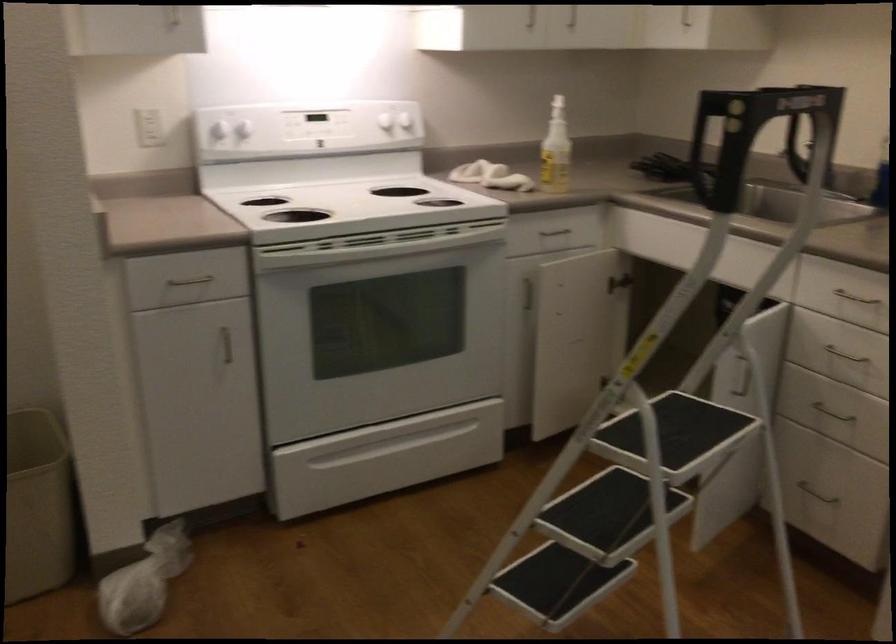
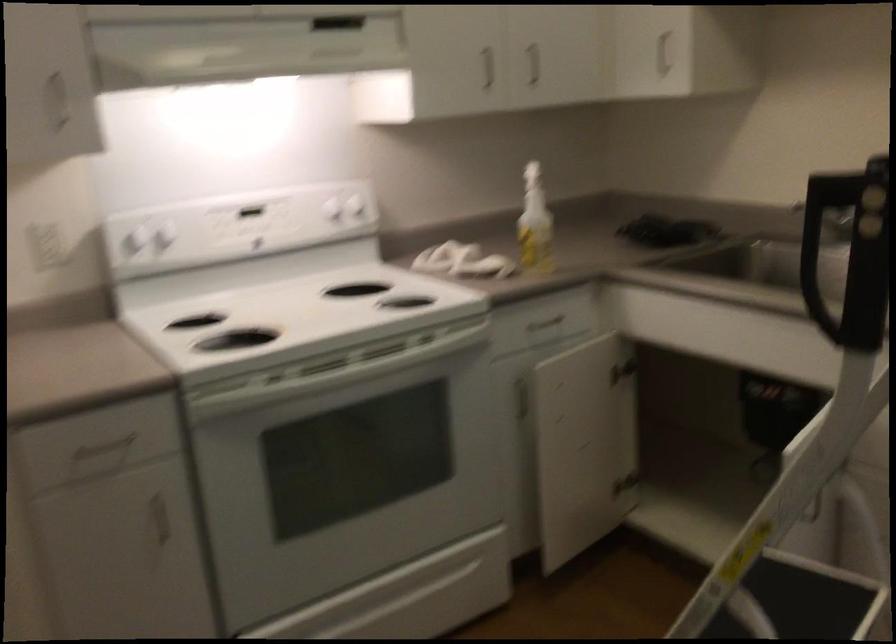
Locate, in the second image, the point that corresponds to pixel 556 147 in the first image.

(535, 223)